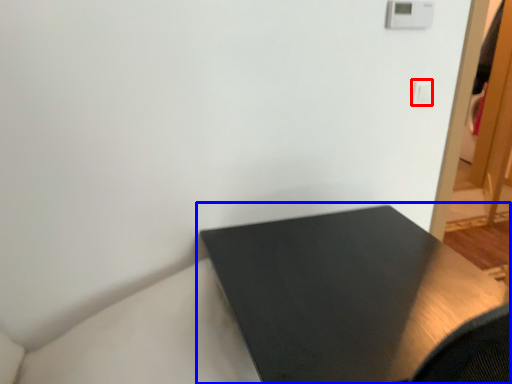
Question: Which object appears closest to the camera in this image, light switch (highlighted by a red box) or table (highlighted by a blue box)?

Choices:
 (A) light switch
 (B) table

Answer: (B)